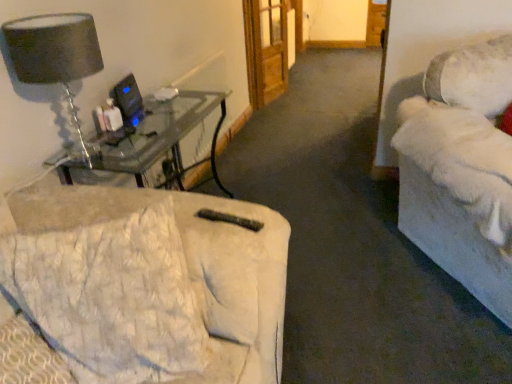
Question: Can you confirm if black plastic computer monitor at upper left is positioned to the right of white plush couch at right, the second studio couch from the left?

Choices:
 (A) no
 (B) yes

Answer: (A)

Question: Can you confirm if black plastic computer monitor at upper left is wider than white plush couch at right, which is the first studio couch in right-to-left order?

Choices:
 (A) yes
 (B) no

Answer: (B)

Question: Is the depth of black plastic computer monitor at upper left less than that of white plush couch at right, which is the first studio couch in right-to-left order?

Choices:
 (A) no
 (B) yes

Answer: (A)

Question: Can you confirm if black plastic computer monitor at upper left is shorter than white plush couch at right, which is the first studio couch in right-to-left order?

Choices:
 (A) no
 (B) yes

Answer: (B)

Question: From the image's perspective, would you say black plastic computer monitor at upper left is positioned over white plush couch at right, the second studio couch from the left?

Choices:
 (A) no
 (B) yes

Answer: (B)

Question: Considering their positions, is white quilted fabric at lower left, placed as the 2th studio couch when sorted from right to left, located in front of or behind white plush couch at right, the second studio couch from the left?

Choices:
 (A) behind
 (B) front

Answer: (B)

Question: Is white quilted fabric at lower left, the first studio couch positioned from the left, taller or shorter than white plush couch at right, the second studio couch from the left?

Choices:
 (A) tall
 (B) short

Answer: (B)

Question: Is point (172, 307) closer or farther from the camera than point (400, 177)?

Choices:
 (A) closer
 (B) farther

Answer: (A)

Question: Based on their positions, is white quilted fabric at lower left, placed as the 2th studio couch when sorted from right to left, located to the left or right of white plush couch at right, the second studio couch from the left?

Choices:
 (A) right
 (B) left

Answer: (B)

Question: Is point (462, 215) positioned closer to the camera than point (265, 18)?

Choices:
 (A) closer
 (B) farther

Answer: (A)

Question: Is white plush couch at right, the second studio couch from the left, wider or thinner than wooden door at center?

Choices:
 (A) thin
 (B) wide

Answer: (B)

Question: From a real-world perspective, is white plush couch at right, the second studio couch from the left, physically located above or below wooden door at center?

Choices:
 (A) below
 (B) above

Answer: (B)

Question: Is white plush couch at right, the second studio couch from the left, inside or outside of wooden door at center?

Choices:
 (A) inside
 (B) outside

Answer: (B)

Question: Visually, is white plush couch at right, which is the first studio couch in right-to-left order, positioned to the left or to the right of white quilted fabric at lower left, the first studio couch positioned from the left?

Choices:
 (A) right
 (B) left

Answer: (A)

Question: From the image's perspective, is white plush couch at right, which is the first studio couch in right-to-left order, located above or below white quilted fabric at lower left, the first studio couch positioned from the left?

Choices:
 (A) below
 (B) above

Answer: (B)